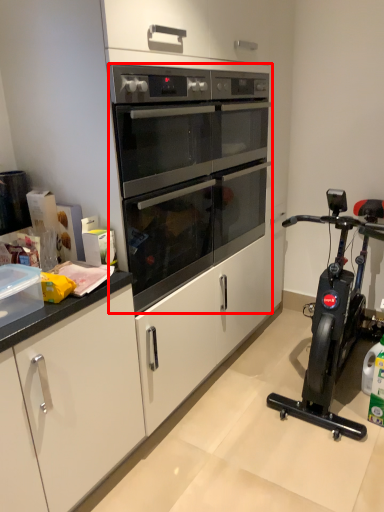
Question: From the image's perspective, what is the correct spatial positioning of oven (annotated by the red box) in reference to home appliance?

Choices:
 (A) below
 (B) above

Answer: (B)